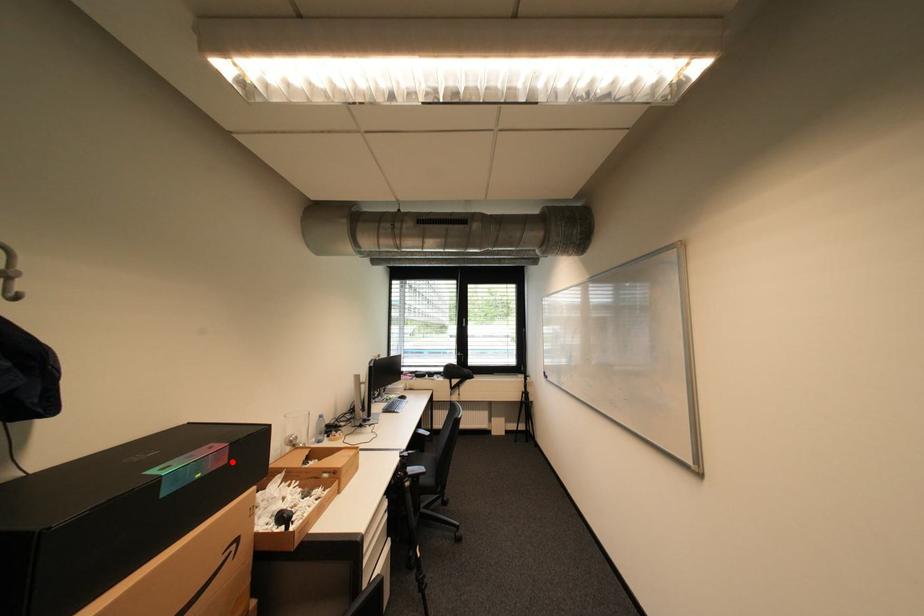
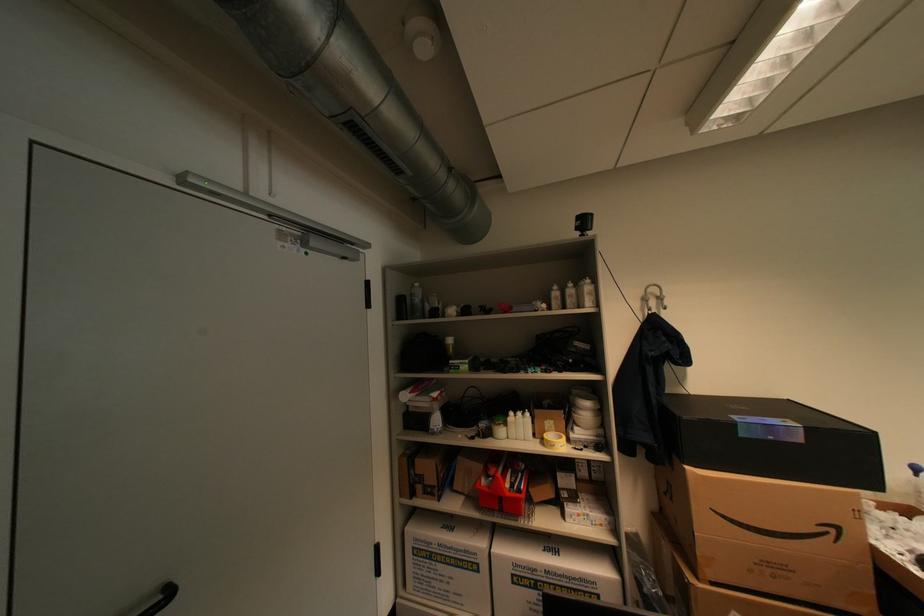
Locate, in the second image, the point that corresponds to the highlighted location in the first image.

(808, 440)